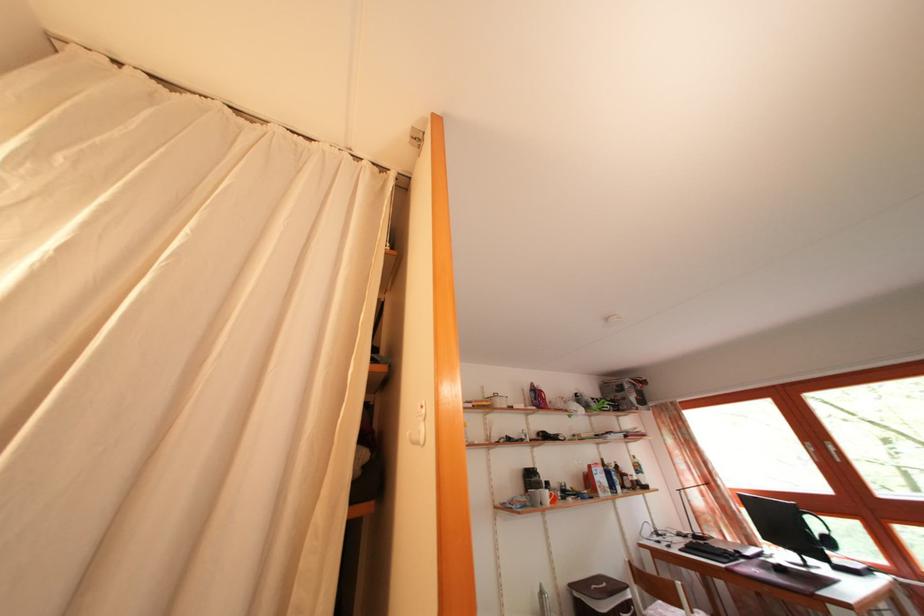
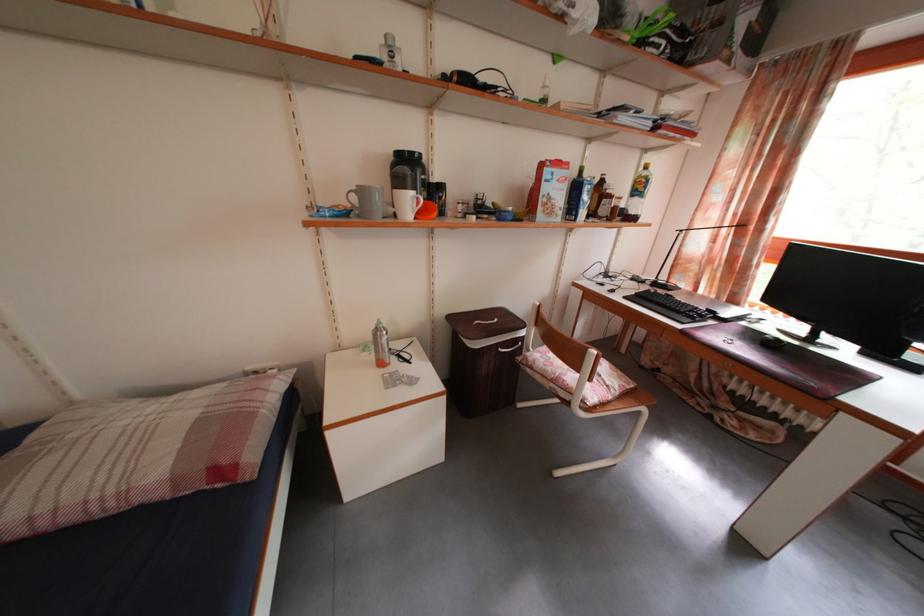
In the second image, find the point that corresponds to the point at 630,453 in the first image.

(643, 161)